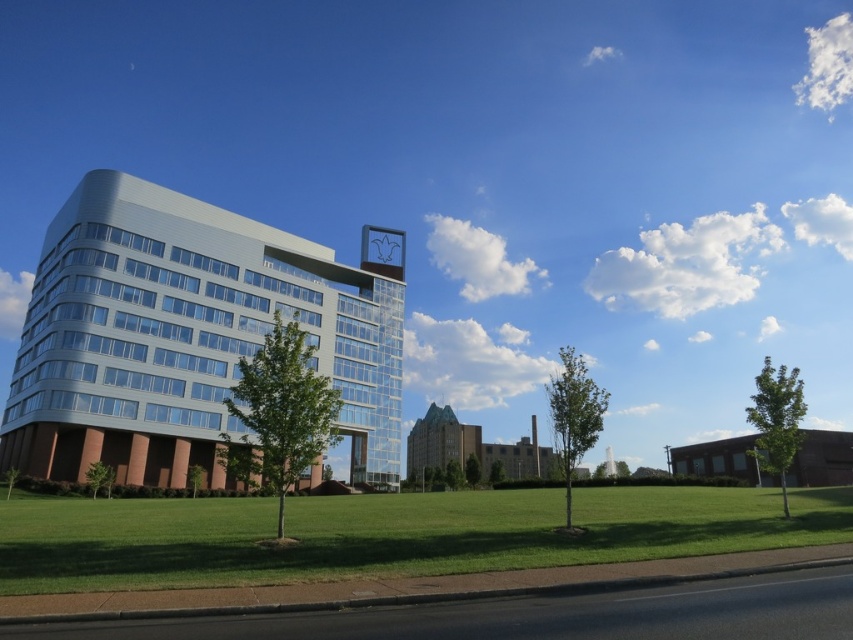
Question: Is metallic glass building at center smaller than green grass at lower center?

Choices:
 (A) no
 (B) yes

Answer: (A)

Question: Which point is farther to the camera?

Choices:
 (A) metallic glass building at center
 (B) green grass at lower center

Answer: (A)

Question: Is metallic glass building at center positioned before green grass at lower center?

Choices:
 (A) yes
 (B) no

Answer: (B)

Question: Is metallic glass building at center below green grass at lower center?

Choices:
 (A) yes
 (B) no

Answer: (B)

Question: Which point appears closest to the camera in this image?

Choices:
 (A) 125,208
 (B) 189,557

Answer: (B)

Question: Among these points, which one is farthest from the camera?

Choices:
 (A) (45, 515)
 (B) (68, 273)

Answer: (B)